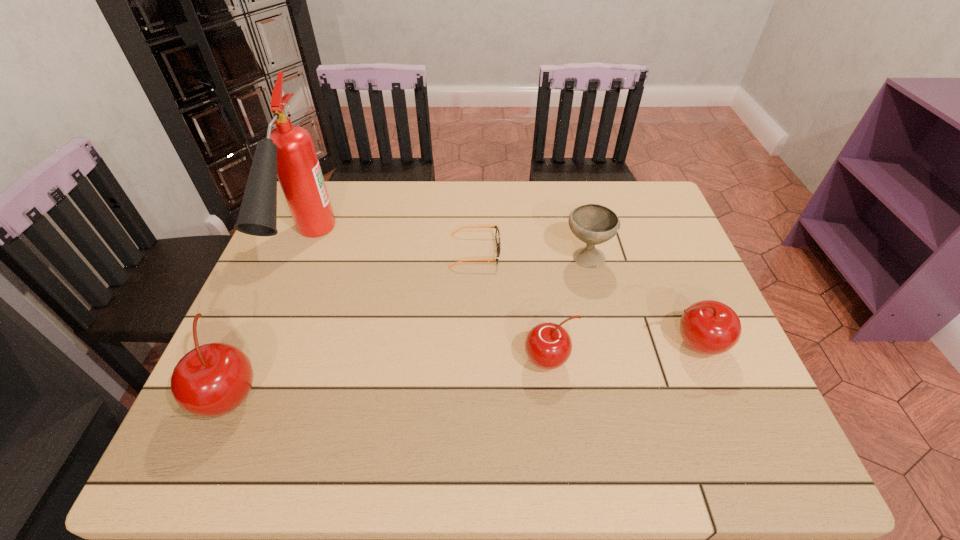
Locate an element on the screen. This screenshot has height=540, width=960. free spot between the second object from right to left and the spectacles is located at coordinates (531, 254).

Find the location of a particular element. The image size is (960, 540). unoccupied area between the fifth object from left to right and the spectacles is located at coordinates (531, 254).

This screenshot has height=540, width=960. I want to click on vacant region between the shortest cherry and the tallest object, so click(428, 305).

The width and height of the screenshot is (960, 540). I want to click on free space between the fire extinguisher and the chalice, so click(446, 254).

The height and width of the screenshot is (540, 960). Identify the location of free spot between the rightmost object and the fire extinguisher. (501, 298).

You are a GUI agent. You are given a task and a screenshot of the screen. Output one action in this format:
    pyautogui.click(x=<x>, y=<y>)
    Task: Click on the free point between the shortest object and the leftmost cherry
    The height and width of the screenshot is (540, 960).
    Given the screenshot: What is the action you would take?
    pyautogui.click(x=353, y=322)

The image size is (960, 540). Identify the location of unoccupied position between the chalice and the second shortest cherry. (640, 301).

In order to click on object identified as the closest to the leftmost cherry in this screenshot , I will do tap(288, 152).

The image size is (960, 540). Identify the location of object identified as the fifth closest to the fifth object from left to right. (213, 379).

The width and height of the screenshot is (960, 540). I want to click on cherry that is the second nearest to the leftmost cherry, so click(708, 327).